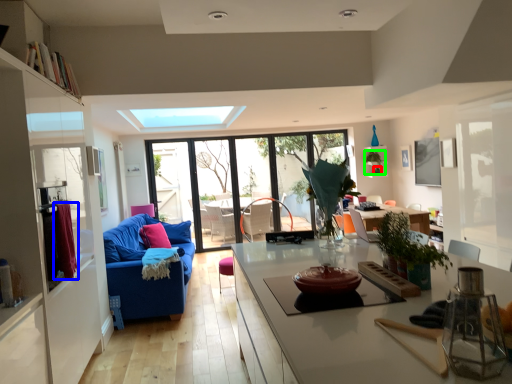
Question: Which is farther away from plant (highlighted by a red box)? curtain (highlighted by a blue box) or plant (highlighted by a green box)?

Choices:
 (A) curtain
 (B) plant

Answer: (A)